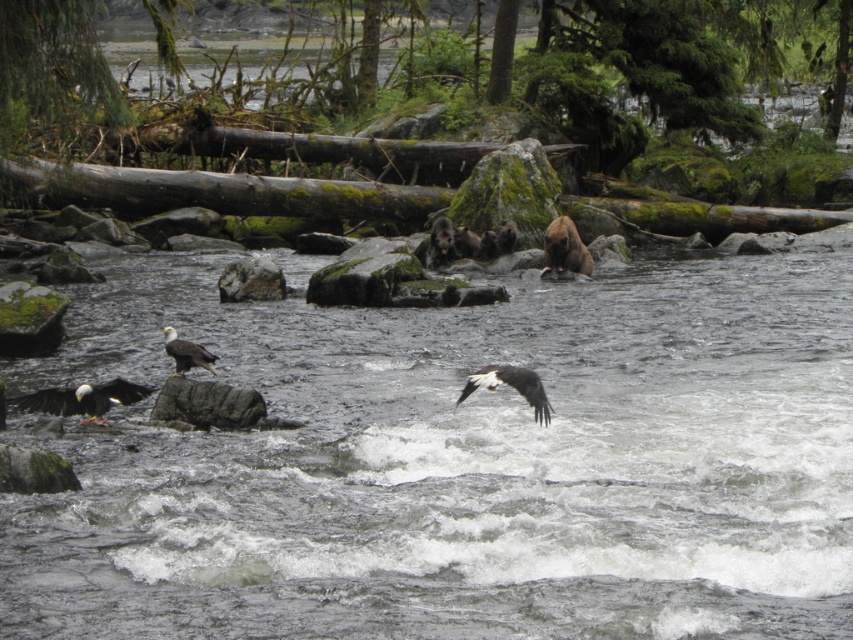
You are standing on the riverbank and want to cross to the other side. The clear water at center is 6.80 meters away from you. If your inflatable boat can carry a maximum weight of 100 kg and you weigh 70 kg, how many 15 kg items can you safely transport in one trip without exceeding the boat capacity?

The boat can carry a maximum of 100 kg. Subtracting your weight of 70 kg, there is 30 kg remaining. Each item is 15 kg, so you can safely carry 2 items without exceeding the limit.